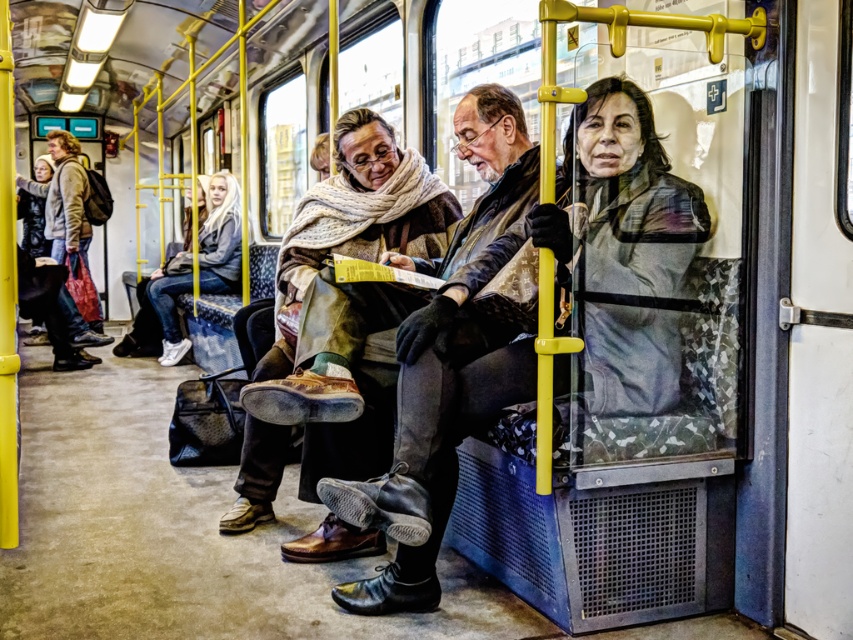
You are a passenger on a tram and you have two points marked in the scene. The first point is at coordinate point (523, 214) and the second is at point (219, 259). Which of these points is closer to you?

Point (523, 214) is closer to the viewer than point (219, 259).

You are a passenger on the tram and want to know if the leather jacket at center can fit into a small overhead compartment that can only accommodate items shorter than the white denim jeans at left. Can it?

The leather jacket at center has a lesser height compared to white denim jeans at left. Therefore, the leather jacket at center can fit into the overhead compartment since it is shorter than the white denim jeans at left, which is the maximum allowed height.